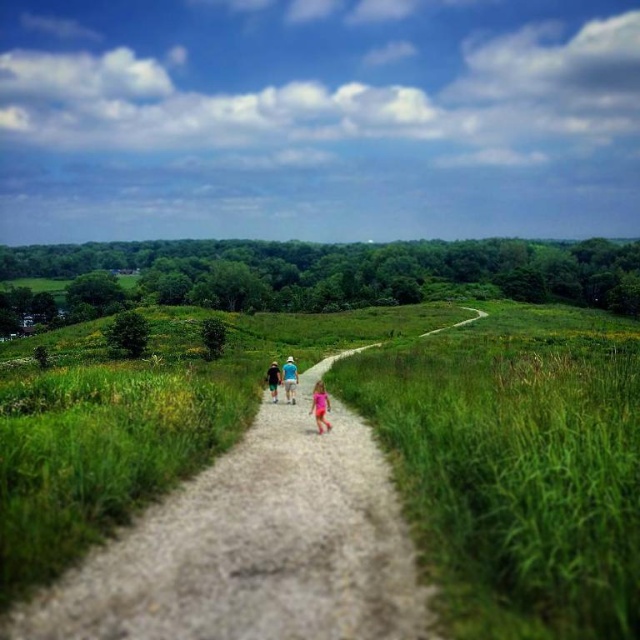
Is point (570, 429) closer to viewer compared to point (198, 486)?

Yes, it is in front of point (198, 486).

Is green grassy at center closer to the viewer compared to dirt path at center?

Yes, green grassy at center is in front of dirt path at center.

What do you see at coordinates (513, 476) in the screenshot?
I see `green grassy at center` at bounding box center [513, 476].

Locate an element on the screen. This screenshot has width=640, height=640. green grassy at center is located at coordinates (513, 476).

What do you see at coordinates (282, 380) in the screenshot?
I see `blue cotton shirt at center` at bounding box center [282, 380].

Who is positioned more to the right, blue cotton shirt at center or blue denim shorts at center?

blue cotton shirt at center is more to the right.

Is point (292, 380) positioned in front of point (269, 388)?

Yes.

Find the location of a particular element. This screenshot has width=640, height=640. blue cotton shirt at center is located at coordinates (282, 380).

Is dirt path at center taller than blue fabric shirt at center?

Indeed, dirt path at center has a greater height compared to blue fabric shirt at center.

Consider the image. Does dirt path at center appear on the left side of blue fabric shirt at center?

No, dirt path at center is not to the left of blue fabric shirt at center.

Which is behind, point (276, 584) or point (291, 362)?

Point (291, 362)

The width and height of the screenshot is (640, 640). Identify the location of dirt path at center. (253, 547).